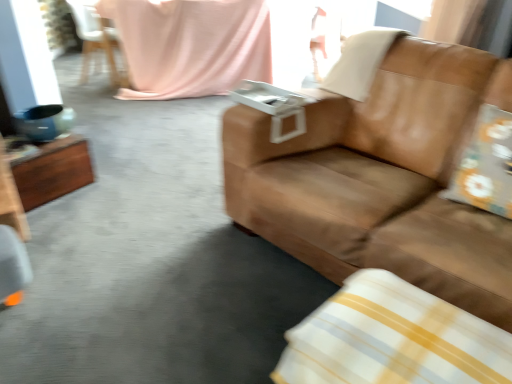
Question: Relative to white/yellow striped pillow at lower right, marked as the 3th pillow in a top-to-bottom arrangement, is floral fabric pillow at right, which ranks as the second pillow in bottom-to-top order, in front or behind?

Choices:
 (A) front
 (B) behind

Answer: (B)

Question: Do you think floral fabric pillow at right, which is counted as the second pillow, starting from the top, is within white/yellow striped pillow at lower right, which is counted as the third pillow, starting from the back, or outside of it?

Choices:
 (A) outside
 (B) inside

Answer: (A)

Question: Which is farther from the white plastic chair at upper left?

Choices:
 (A) brown leather couch at center
 (B) wooden table at left
 (C) beige leather pillow at upper right, the first pillow positioned from the back
 (D) floral fabric pillow at right, which appears as the 2th pillow when viewed from the back
 (E) pink fabric at upper center

Answer: (D)

Question: Based on their relative distances, which object is farther from the floral fabric pillow at right, which appears as the 2th pillow when viewed from the back?

Choices:
 (A) white/yellow striped pillow at lower right, marked as the 3th pillow in a top-to-bottom arrangement
 (B) brown leather couch at center
 (C) white plastic chair at upper left
 (D) beige leather pillow at upper right, placed as the third pillow when sorted from bottom to top
 (E) pink fabric at upper center

Answer: (C)